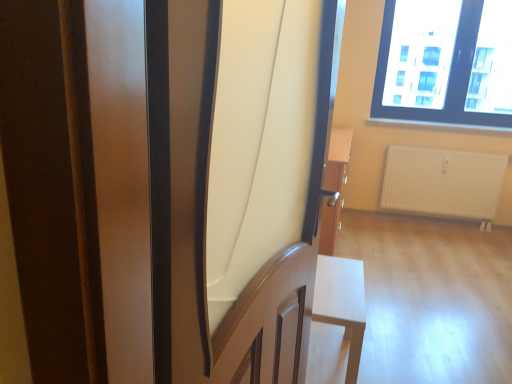
What are the coordinates of `vacant space underneath white matte radiator at lower right (from a real-world perspective)` in the screenshot? It's located at (440, 223).